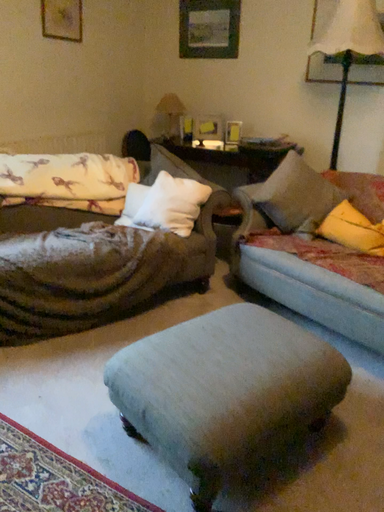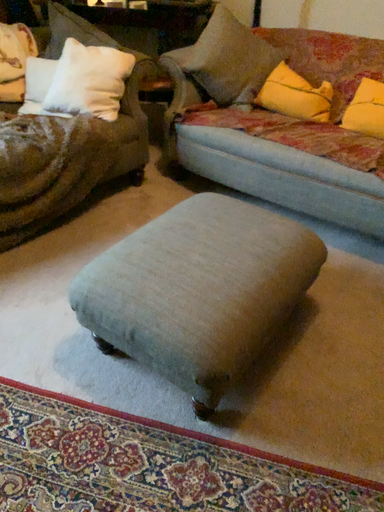
Question: Which way did the camera rotate in the video?

Choices:
 (A) rotated right
 (B) rotated left

Answer: (A)